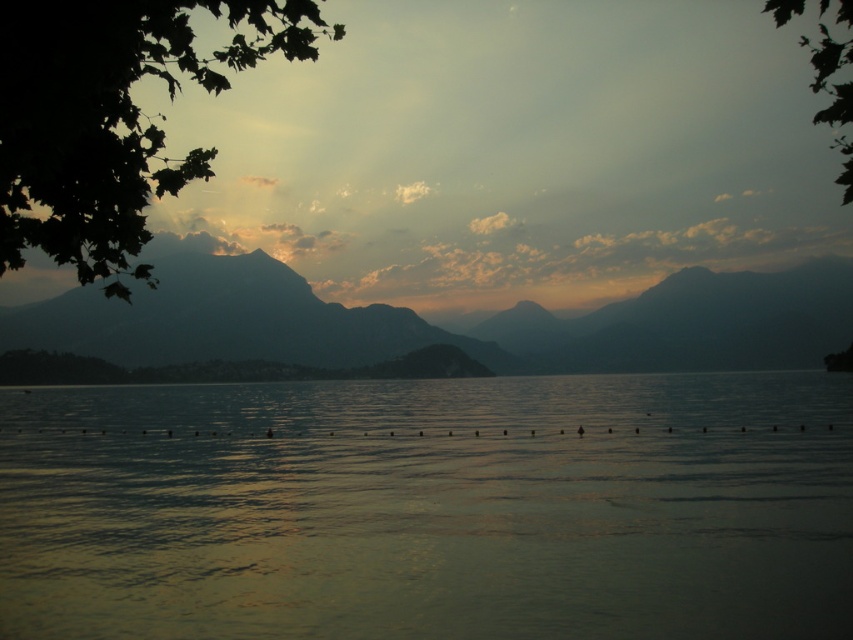
Question: Among these points, which one is farthest from the camera?

Choices:
 (A) (766, 4)
 (B) (109, 156)
 (C) (370, 332)

Answer: (C)

Question: Which point is closer to the camera?

Choices:
 (A) green leafy tree at upper right
 (B) silvery reflective water at center

Answer: (A)

Question: Does silvery reflective water at center have a greater width compared to green leafy tree at upper left?

Choices:
 (A) yes
 (B) no

Answer: (A)

Question: Is silvery reflective water at center bigger than green leafy tree at upper left?

Choices:
 (A) no
 (B) yes

Answer: (A)

Question: Based on their relative distances, which object is nearer to the silvery reflective water at center?

Choices:
 (A) green leafy tree at upper left
 (B) green leafy tree at upper right

Answer: (A)

Question: Does silvery reflective water at center appear over green leafy tree at upper right?

Choices:
 (A) no
 (B) yes

Answer: (A)